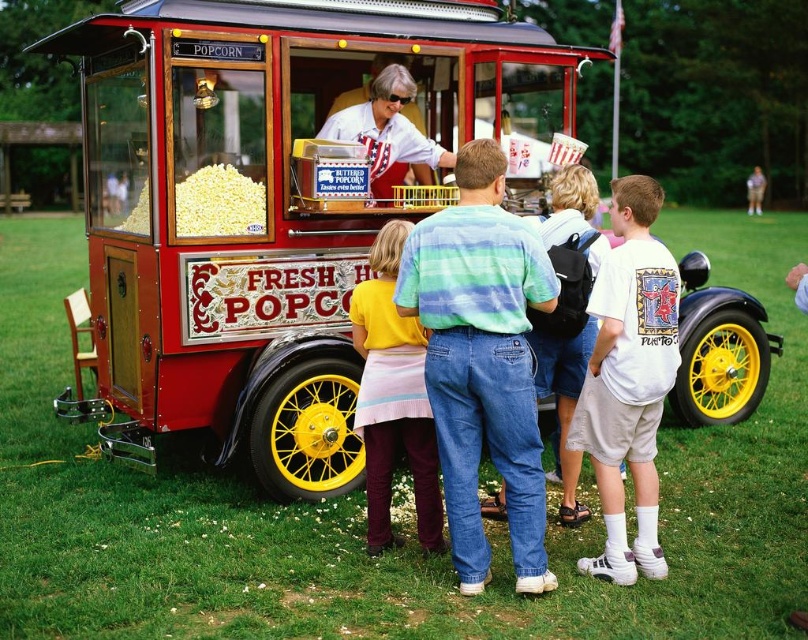
Is point (442, 380) positioned behind point (587, 428)?

No.

Which is in front, point (506, 308) or point (636, 488)?

Point (506, 308)

What are the coordinates of `denim jeans at center` in the screenshot? It's located at tap(482, 360).

Between red polished wood popcorn cart at center and denim jeans at center, which one appears on the left side from the viewer's perspective?

Positioned to the left is red polished wood popcorn cart at center.

From the picture: Is red polished wood popcorn cart at center positioned in front of denim jeans at center?

That is False.

The width and height of the screenshot is (808, 640). What do you see at coordinates (268, 204) in the screenshot?
I see `red polished wood popcorn cart at center` at bounding box center [268, 204].

You are a GUI agent. You are given a task and a screenshot of the screen. Output one action in this format:
    pyautogui.click(x=<x>, y=<y>)
    Task: Click on the red polished wood popcorn cart at center
    
    Given the screenshot: What is the action you would take?
    pyautogui.click(x=268, y=204)

Is point (531, 84) farther from camera compared to point (595, 292)?

Yes, it is behind point (595, 292).

Describe the element at coordinates (268, 204) in the screenshot. This screenshot has height=640, width=808. I see `red polished wood popcorn cart at center` at that location.

At what (x,y) coordinates should I click in order to perform the action: click on red polished wood popcorn cart at center. Please return your answer as a coordinate pair (x, y). This screenshot has width=808, height=640. Looking at the image, I should click on (268, 204).